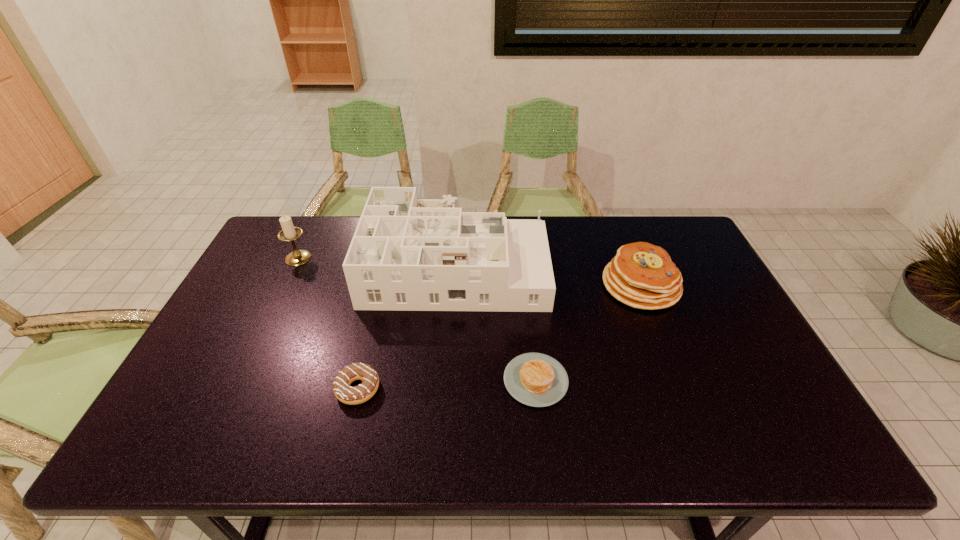
At what (x,y) coordinates should I click in order to perform the action: click on object that is the third closest one to the third shortest object. Please return your answer as a coordinate pair (x, y). The image size is (960, 540). Looking at the image, I should click on (343, 391).

Identify the location of free space that satisfies the following two spatial constraints: 1. on the front side of the left pancake; 2. on the left side of the candle holder. (240, 380).

This screenshot has height=540, width=960. I want to click on vacant region that satisfies the following two spatial constraints: 1. on the front side of the dollhouse; 2. on the left side of the taller pancake, so click(x=455, y=285).

I want to click on free location that satisfies the following two spatial constraints: 1. on the back side of the nearer pancake; 2. on the right side of the taller pancake, so click(525, 285).